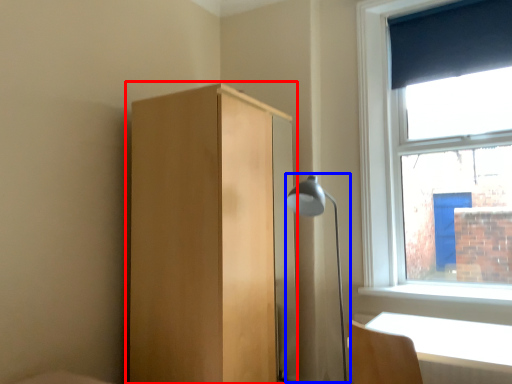
Question: Among these objects, which one is nearest to the camera, dresser (highlighted by a red box) or lamp (highlighted by a blue box)?

Choices:
 (A) dresser
 (B) lamp

Answer: (A)